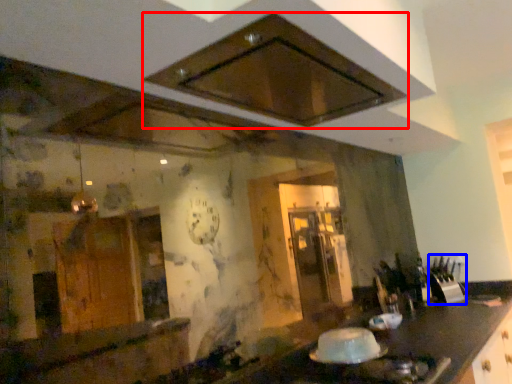
Question: Which object appears closest to the camera in this image, exhaust hood (highlighted by a red box) or appliance (highlighted by a blue box)?

Choices:
 (A) exhaust hood
 (B) appliance

Answer: (A)